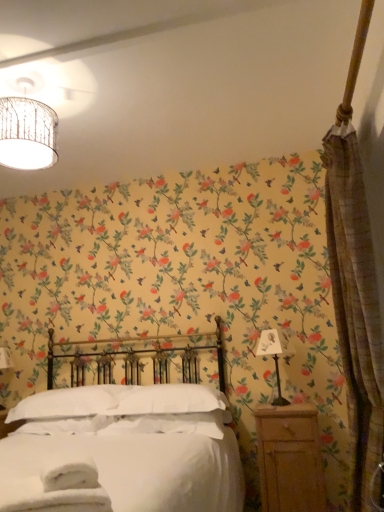
Question: Is textured beige curtain at right wider than white soft pillow at center, the first pillow when ordered from right to left?

Choices:
 (A) no
 (B) yes

Answer: (A)

Question: Considering the relative sizes of textured beige curtain at right and white soft pillow at center, the first pillow when ordered from right to left, in the image provided, is textured beige curtain at right shorter than white soft pillow at center, the first pillow when ordered from right to left,?

Choices:
 (A) yes
 (B) no

Answer: (B)

Question: Can you see textured beige curtain at right touching white soft pillow at center, which is counted as the 2th pillow, starting from the left?

Choices:
 (A) yes
 (B) no

Answer: (B)

Question: Does textured beige curtain at right appear on the right side of white soft pillow at center, the first pillow when ordered from right to left?

Choices:
 (A) no
 (B) yes

Answer: (B)

Question: From the image's perspective, is textured beige curtain at right beneath white soft pillow at center, the first pillow when ordered from right to left?

Choices:
 (A) no
 (B) yes

Answer: (A)

Question: Considering the relative sizes of textured beige curtain at right and white soft pillow at center, the first pillow when ordered from right to left, in the image provided, is textured beige curtain at right smaller than white soft pillow at center, the first pillow when ordered from right to left,?

Choices:
 (A) yes
 (B) no

Answer: (B)

Question: From the image's perspective, is matte woven lampshade at upper left under metallic silver lamp at right?

Choices:
 (A) no
 (B) yes

Answer: (A)

Question: Is matte woven lampshade at upper left placed right next to metallic silver lamp at right?

Choices:
 (A) yes
 (B) no

Answer: (B)

Question: From a real-world perspective, is matte woven lampshade at upper left on top of metallic silver lamp at right?

Choices:
 (A) yes
 (B) no

Answer: (A)

Question: Is matte woven lampshade at upper left further to camera compared to metallic silver lamp at right?

Choices:
 (A) no
 (B) yes

Answer: (A)

Question: Is matte woven lampshade at upper left at the right side of metallic silver lamp at right?

Choices:
 (A) yes
 (B) no

Answer: (B)

Question: Does matte woven lampshade at upper left turn towards metallic silver lamp at right?

Choices:
 (A) no
 (B) yes

Answer: (A)

Question: From the image's perspective, does white soft pillow at center, positioned as the 1th pillow in left-to-right order, appear lower than matte woven lampshade at upper left?

Choices:
 (A) yes
 (B) no

Answer: (A)